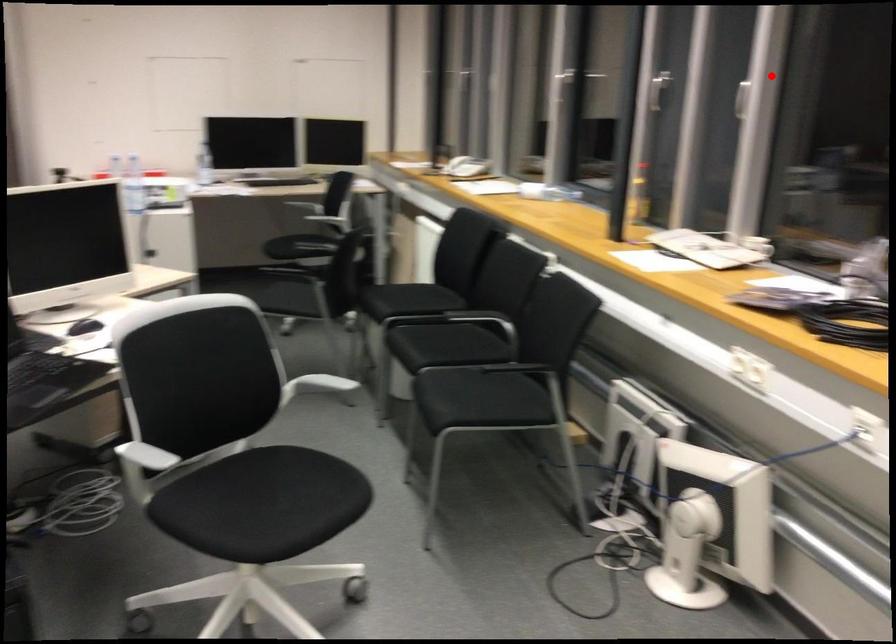
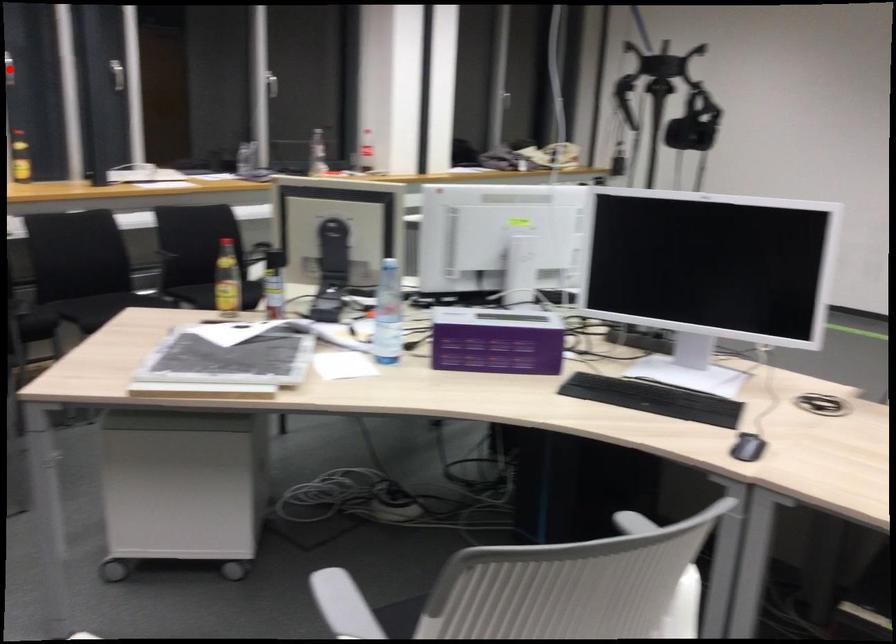
I am providing you with two images of the same scene from different viewpoints. A red point is marked on the first image and another point is marked on the second image. Is the marked point in image1 the same physical position as the marked point in image2?

No